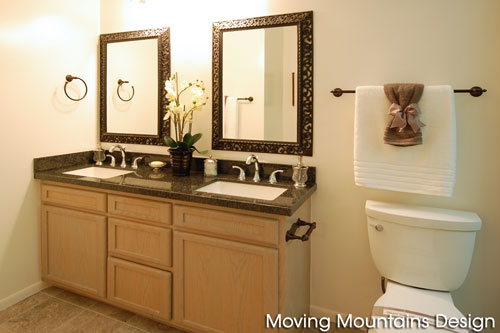
Where is `toilet`? toilet is located at coordinates (414, 265).